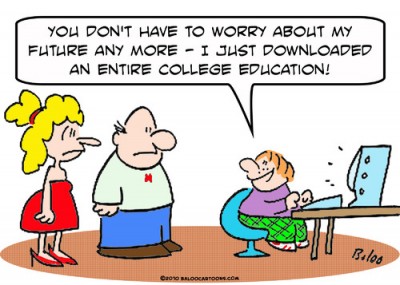
Locate an element on the screen. This screenshot has width=400, height=285. computer is located at coordinates (368, 163).